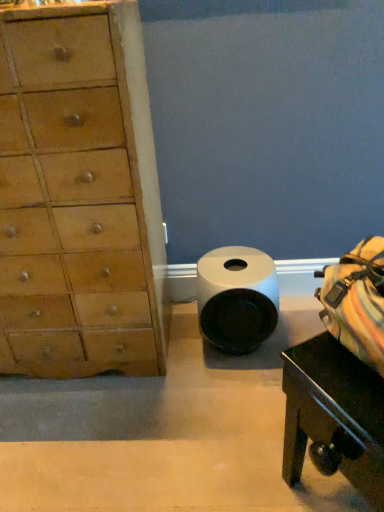
This screenshot has width=384, height=512. Identify the location of free location above white matte toilet paper at center (from a real-world perspective). (233, 266).